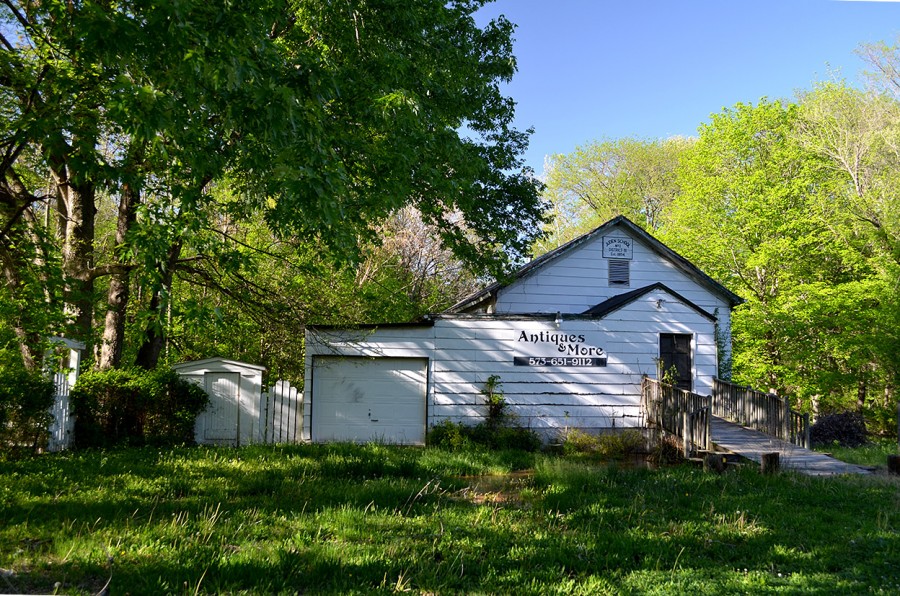
Locate an element on the screen. This screenshot has height=596, width=900. door is located at coordinates (220, 406), (680, 366).